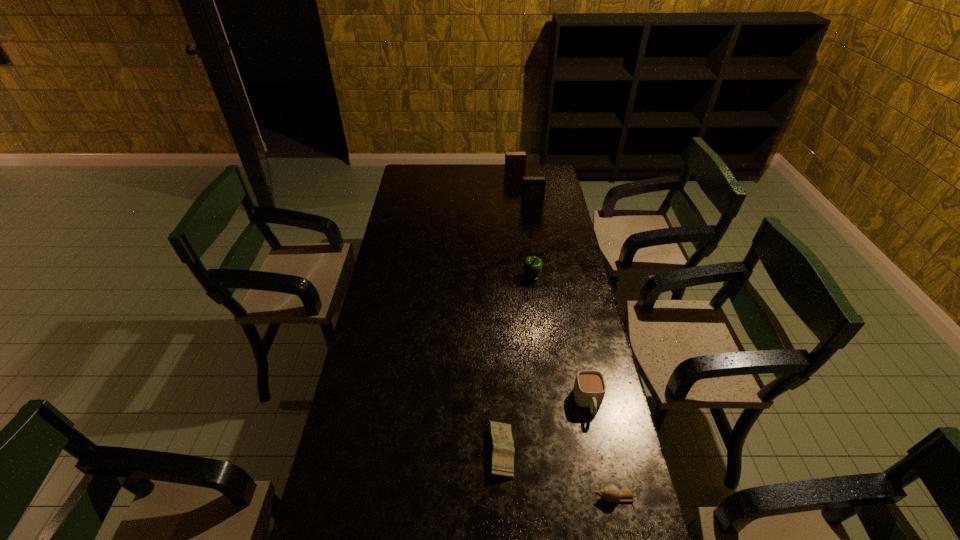
Image resolution: width=960 pixels, height=540 pixels. Identify the location of the second farthest diary. (533, 187).

Identify the location of the farthest diary. The image size is (960, 540). (515, 161).

The image size is (960, 540). I want to click on bell pepper, so click(532, 265).

Locate an element on the screen. The width and height of the screenshot is (960, 540). the fourth farthest object is located at coordinates (589, 388).

This screenshot has width=960, height=540. In order to click on cup in this screenshot , I will do (589, 388).

Image resolution: width=960 pixels, height=540 pixels. I want to click on the shortest diary, so click(x=501, y=451).

Locate an element on the screen. the second nearest object is located at coordinates (501, 451).

What are the coordinates of `escargot` in the screenshot? It's located at (610, 492).

Where is `free space located on the front cover of the fifth nearest object`? The height and width of the screenshot is (540, 960). free space located on the front cover of the fifth nearest object is located at coordinates (535, 223).

Image resolution: width=960 pixels, height=540 pixels. Find the location of `free space located on the spine side of the farthest diary`. free space located on the spine side of the farthest diary is located at coordinates (490, 176).